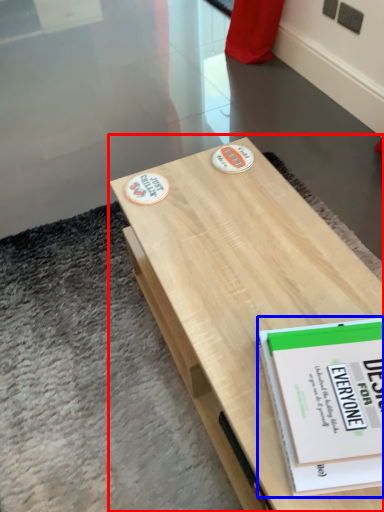
Question: Which point is closer to the camera, table (highlighted by a red box) or book (highlighted by a blue box)?

Choices:
 (A) table
 (B) book

Answer: (A)